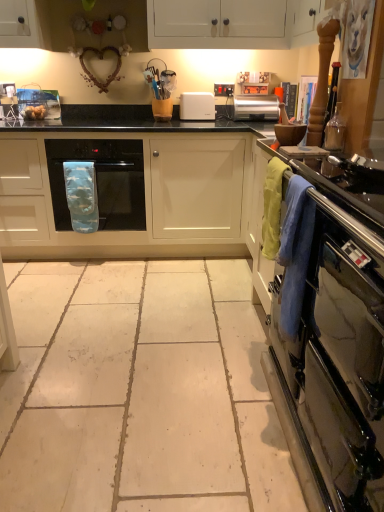
Where is `black matte countertop at center`? black matte countertop at center is located at coordinates [136, 190].

This screenshot has height=512, width=384. In order to click on soft cotton towel at right in this screenshot , I will do `click(295, 253)`.

Describe the element at coordinates (334, 370) in the screenshot. The width and height of the screenshot is (384, 512). I see `stainless steel oven at right` at that location.

At what (x,y) coordinates should I click in order to perform the action: click on white plastic toaster at center, the first appliance positioned from the left. Please return your answer as a coordinate pair (x, y). This screenshot has width=384, height=512. Looking at the image, I should click on (197, 106).

Find the location of a particular element. golden brown bread at left is located at coordinates (34, 112).

Between stainless steel oven at right and white plastic toaster at center, placed as the second appliance when sorted from bottom to top, which one has less height?

white plastic toaster at center, placed as the second appliance when sorted from bottom to top.

Is stainless steel oven at right looking in the opposite direction of white plastic toaster at center, placed as the second appliance when sorted from bottom to top?

No.

Is point (343, 396) closer or farther from the camera than point (191, 101)?

Point (343, 396).

Considering the sizes of objects black matte countertop at center and white plastic toaster at center, the 2th appliance from the right, in the image provided, who is bigger, black matte countertop at center or white plastic toaster at center, the 2th appliance from the right,?

black matte countertop at center is bigger.

Find the location of a particular element. This screenshot has width=384, height=512. appliance behind the black matte countertop at center is located at coordinates (197, 106).

Considering the relative positions of black matte countertop at center and white plastic toaster at center, which is counted as the 1th appliance, starting from the top, in the image provided, is black matte countertop at center to the left of white plastic toaster at center, which is counted as the 1th appliance, starting from the top, from the viewer's perspective?

Indeed, black matte countertop at center is positioned on the left side of white plastic toaster at center, which is counted as the 1th appliance, starting from the top.

Does point (300, 246) appear closer or farther from the camera than point (213, 119)?

Clearly, point (300, 246) is closer to the camera than point (213, 119).

From the image's perspective, is soft cotton towel at right located beneath white plastic toaster at center, placed as the second appliance when sorted from bottom to top?

Yes, from the image's perspective, soft cotton towel at right is below white plastic toaster at center, placed as the second appliance when sorted from bottom to top.

How different are the orientations of soft cotton towel at right and white plastic toaster at center, the first appliance positioned from the left, in degrees?

The angle between the facing direction of soft cotton towel at right and the facing direction of white plastic toaster at center, the first appliance positioned from the left, is 88.1 degrees.

Looking at their sizes, would you say soft cotton towel at right is wider or thinner than white plastic toaster at center, the first appliance positioned from the left?

In the image, soft cotton towel at right appears to be more narrow than white plastic toaster at center, the first appliance positioned from the left.

Does golden brown bread at left have a lesser height compared to blue fabric oven mitt at center?

Yes.

Considering the relative positions of golden brown bread at left and blue fabric oven mitt at center in the image provided, is golden brown bread at left to the left or to the right of blue fabric oven mitt at center?

From the image, it's evident that golden brown bread at left is to the left of blue fabric oven mitt at center.

Is point (31, 119) less distant than point (105, 172)?

No.

Choose the correct answer: Is silver metallic toaster at center inside white plastic toaster at center, which is the 2th appliance from front to back, or outside it?

silver metallic toaster at center is spatially situated outside white plastic toaster at center, which is the 2th appliance from front to back.

Identify the location of appliance that is above the silver metallic toaster at center (from the image's perspective). (197, 106).

Which is more to the left, silver metallic toaster at center or white plastic toaster at center, which is counted as the 1th appliance, starting from the top?

From the viewer's perspective, white plastic toaster at center, which is counted as the 1th appliance, starting from the top, appears more on the left side.

From the image's perspective, is silver metallic toaster at center beneath white plastic toaster at center, positioned as the first appliance in back-to-front order?

Yes, from the image's perspective, silver metallic toaster at center is beneath white plastic toaster at center, positioned as the first appliance in back-to-front order.

Do you think stainless steel oven at right is within blue fabric oven mitt at center, or outside of it?

The correct answer is: outside.

In the image, is stainless steel oven at right positioned in front of or behind blue fabric oven mitt at center?

stainless steel oven at right is in front of blue fabric oven mitt at center.

Considering the sizes of objects stainless steel oven at right and blue fabric oven mitt at center in the image provided, who is thinner, stainless steel oven at right or blue fabric oven mitt at center?

stainless steel oven at right.

Does stainless steel oven at right have a larger size compared to blue fabric oven mitt at center?

Yes, stainless steel oven at right is bigger than blue fabric oven mitt at center.

Considering the sizes of objects stainless steel oven at right and golden brown bread at left in the image provided, who is thinner, stainless steel oven at right or golden brown bread at left?

Thinner between the two is golden brown bread at left.

Is stainless steel oven at right further to camera compared to golden brown bread at left?

No, stainless steel oven at right is closer to the viewer.

Considering the relative sizes of stainless steel oven at right and golden brown bread at left in the image provided, is stainless steel oven at right smaller than golden brown bread at left?

No.

Is stainless steel oven at right at the right side of golden brown bread at left?

Yes, stainless steel oven at right is to the right of golden brown bread at left.

Locate an element on the screen. This screenshot has width=384, height=512. oven directly beneath the white plastic toaster at center, which is counted as the 1th appliance, starting from the top (from a real-world perspective) is located at coordinates (334, 370).

This screenshot has width=384, height=512. In order to click on appliance that is the 2nd one above the black matte countertop at center (from a real-world perspective) in this screenshot , I will do `click(197, 106)`.

Which object lies nearer to the anchor point clear glass bottle at right, arranged as the 1th appliance when viewed from the front, white plastic toaster at center, placed as the second appliance when sorted from bottom to top, or stainless steel oven at right?

stainless steel oven at right is closer to clear glass bottle at right, arranged as the 1th appliance when viewed from the front.

Considering their positions, is black matte countertop at center positioned closer to blue fabric oven mitt at center than silver metallic toaster at center?

black matte countertop at center.

Consider the image. Looking at the image, which one is located closer to blue fabric oven mitt at center, stainless steel oven at right or silver metallic toaster at center?

Based on the image, silver metallic toaster at center appears to be nearer to blue fabric oven mitt at center.

Estimate the real-world distances between objects in this image. Which object is closer to black matte countertop at center, clear glass bottle at right, which is the first appliance in bottom-to-top order, or silver metallic toaster at center?

silver metallic toaster at center is closer to black matte countertop at center.

In the scene shown: Based on their spatial positions, is white plastic toaster at center, which is the 2th appliance from front to back, or stainless steel oven at right closer to golden brown bread at left?

Based on the image, white plastic toaster at center, which is the 2th appliance from front to back, appears to be nearer to golden brown bread at left.

From the image, which object appears to be nearer to clear glass bottle at right, which is the first appliance in bottom-to-top order, black matte countertop at center or stainless steel oven at right?

stainless steel oven at right lies closer to clear glass bottle at right, which is the first appliance in bottom-to-top order, than the other object.

Which object lies further to the anchor point silver metallic toaster at center, stainless steel oven at right or soft cotton towel at right?

Based on the image, stainless steel oven at right appears to be further to silver metallic toaster at center.

From the image, which object appears to be nearer to soft cotton towel at right, clear glass bottle at right, which is the first appliance in bottom-to-top order, or black matte countertop at center?

Based on the image, clear glass bottle at right, which is the first appliance in bottom-to-top order, appears to be nearer to soft cotton towel at right.

At what (x,y) coordinates should I click in order to perform the action: click on laundry located between stainless steel oven at right and clear glass bottle at right, the first appliance when ordered from right to left, in the depth direction. Please return your answer as a coordinate pair (x, y). The height and width of the screenshot is (512, 384). Looking at the image, I should click on (295, 253).

At what (x,y) coordinates should I click in order to perform the action: click on home appliance between soft cotton towel at right and silver metallic toaster at center in the front-back direction. Please return your answer as a coordinate pair (x, y). Looking at the image, I should click on (101, 180).

Find the location of a particular element. The width and height of the screenshot is (384, 512). appliance located between golden brown bread at left and silver metallic toaster at center in the left-right direction is located at coordinates (197, 106).

Where is `countertop between golden brown bread at left and clear glass bottle at right, the first appliance when ordered from right to left, in the horizontal direction`? The image size is (384, 512). countertop between golden brown bread at left and clear glass bottle at right, the first appliance when ordered from right to left, in the horizontal direction is located at coordinates (136, 190).